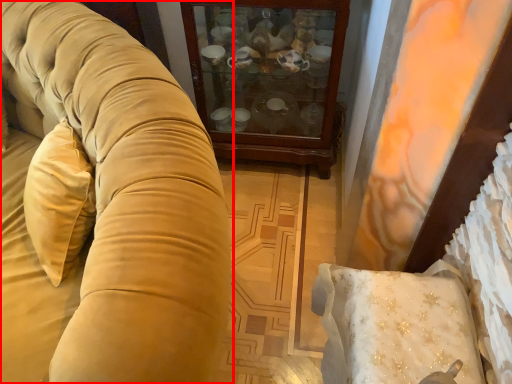
Question: Considering the relative positions of studio couch (annotated by the red box) and furniture in the image provided, where is studio couch (annotated by the red box) located with respect to the staircase?

Choices:
 (A) right
 (B) left

Answer: (B)